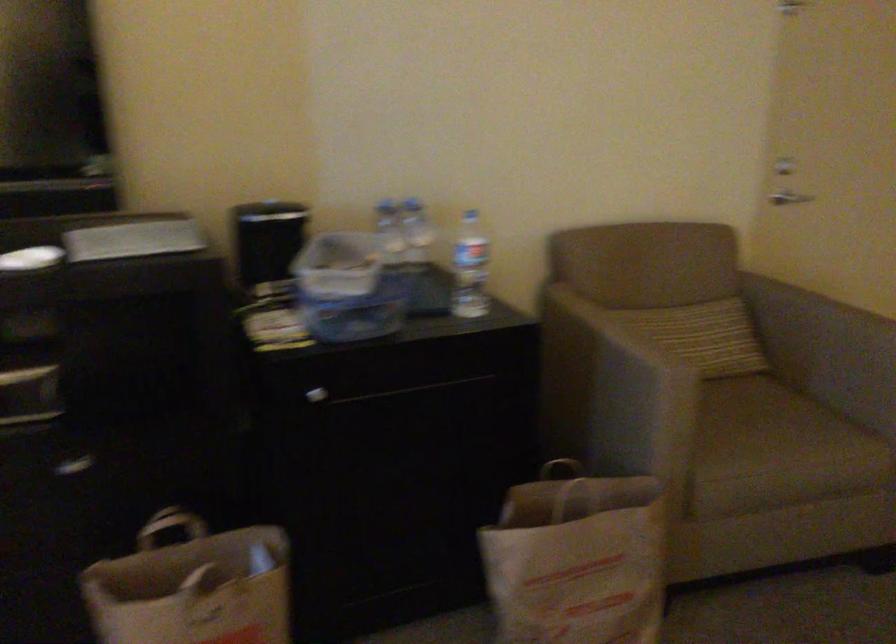
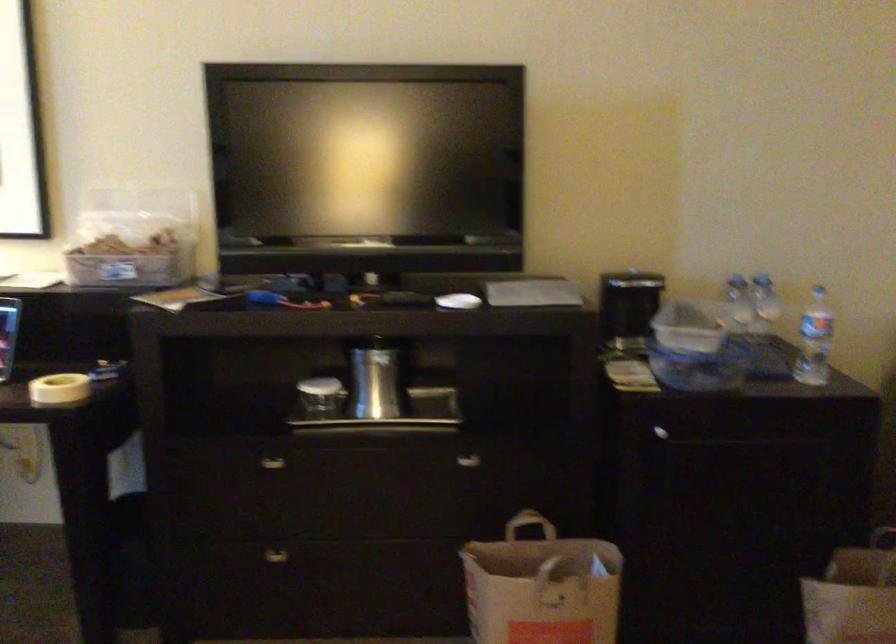
Question: What movement of the cameraman would produce the second image?

Choices:
 (A) Left
 (B) Right
 (C) Forward
 (D) Backward

Answer: (D)